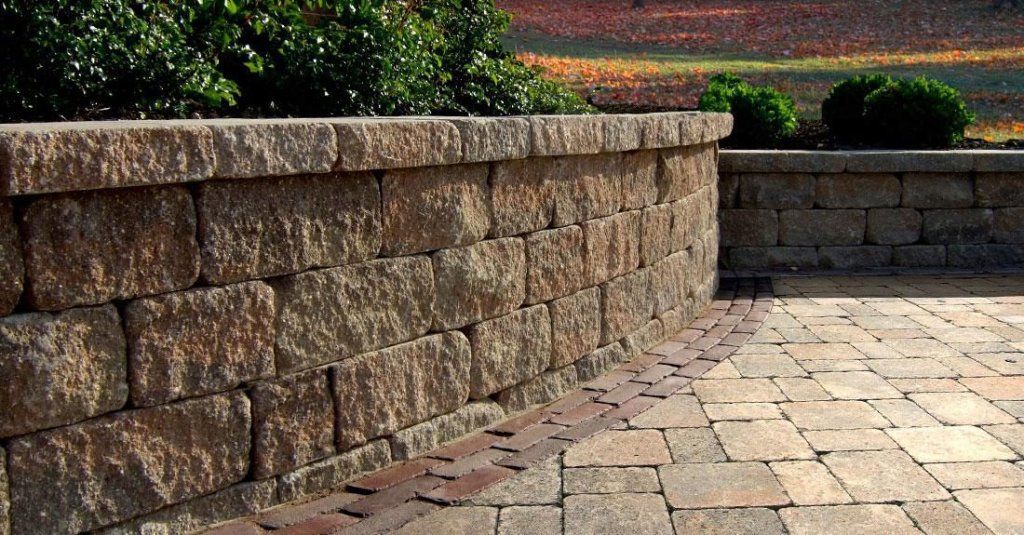
Where is `empty space in front of brick wall`? empty space in front of brick wall is located at coordinates pyautogui.click(x=528, y=461).